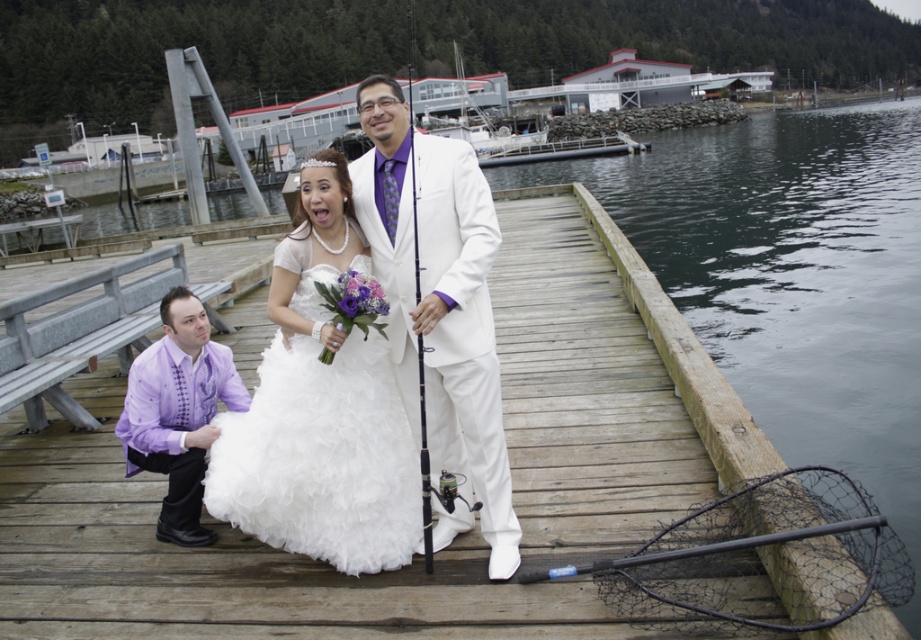
Who is more forward, (371,394) or (179,497)?

Positioned in front is point (371,394).

Who is lower down, white satin dress at center or purple satin shirt at lower left?

purple satin shirt at lower left is lower down.

Is point (364, 490) less distant than point (182, 365)?

Yes, point (364, 490) is closer to viewer.

Find the location of a particular element. white satin dress at center is located at coordinates (359, 356).

Is point (214, 420) closer to viewer compared to point (125, 429)?

No, it is not.

Describe the element at coordinates (321, 442) in the screenshot. The image size is (921, 640). I see `white ruffled fabric dress at center` at that location.

Where is `white ruffled fabric dress at center`? The image size is (921, 640). white ruffled fabric dress at center is located at coordinates (321, 442).

From the picture: Does wooden at center have a larger size compared to black matte fishing pole at center?

No, wooden at center is not bigger than black matte fishing pole at center.

Is wooden at center wider than black matte fishing pole at center?

No.

Where is `wooden at center`? The image size is (921, 640). wooden at center is located at coordinates (602, 388).

You are a GUI agent. You are given a task and a screenshot of the screen. Output one action in this format:
    pyautogui.click(x=<x>, y=<y>)
    Task: Click on the wooden at center
    The width and height of the screenshot is (921, 640).
    Given the screenshot: What is the action you would take?
    pyautogui.click(x=602, y=388)